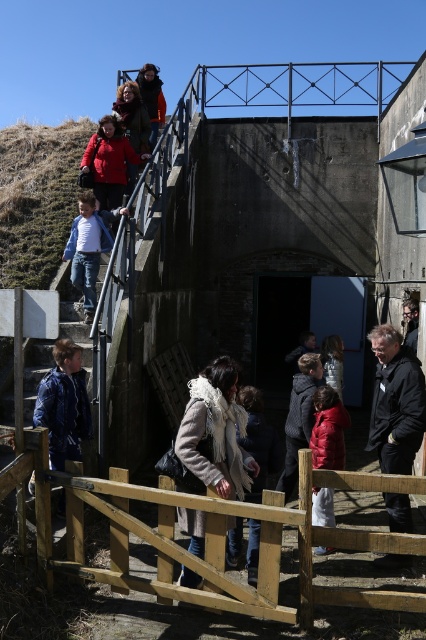
Question: Which of these objects is positioned farthest from the white woolen scarf at center?

Choices:
 (A) dark gray jacket at center
 (B) wooden gate at center
 (C) black matte jacket at lower right

Answer: (A)

Question: From the image, what is the correct spatial relationship of denim jacket at lower left in relation to red matte jacket at lower center?

Choices:
 (A) above
 (B) below

Answer: (A)

Question: Does white woolen scarf at center appear over dark gray jacket at center?

Choices:
 (A) yes
 (B) no

Answer: (B)

Question: Does wooden gate at center have a lesser width compared to black matte jacket at lower right?

Choices:
 (A) no
 (B) yes

Answer: (A)

Question: Which object is the farthest from the dark gray jacket at center?

Choices:
 (A) dark gray wool coat at center
 (B) white woolen scarf at center
 (C) dark brown leather jacket at upper center

Answer: (B)

Question: Which point is farther from the camera taking this photo?

Choices:
 (A) (291, 476)
 (B) (89, 221)
 (C) (258, 461)
 (D) (160, 554)

Answer: (B)